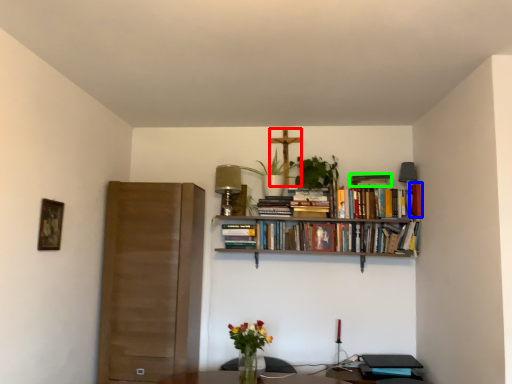
Question: Estimate the real-world distances between objects in this image. Which object is farther from crucifix (highlighted by a red box), book (highlighted by a blue box) or book (highlighted by a green box)?

Choices:
 (A) book
 (B) book

Answer: (A)